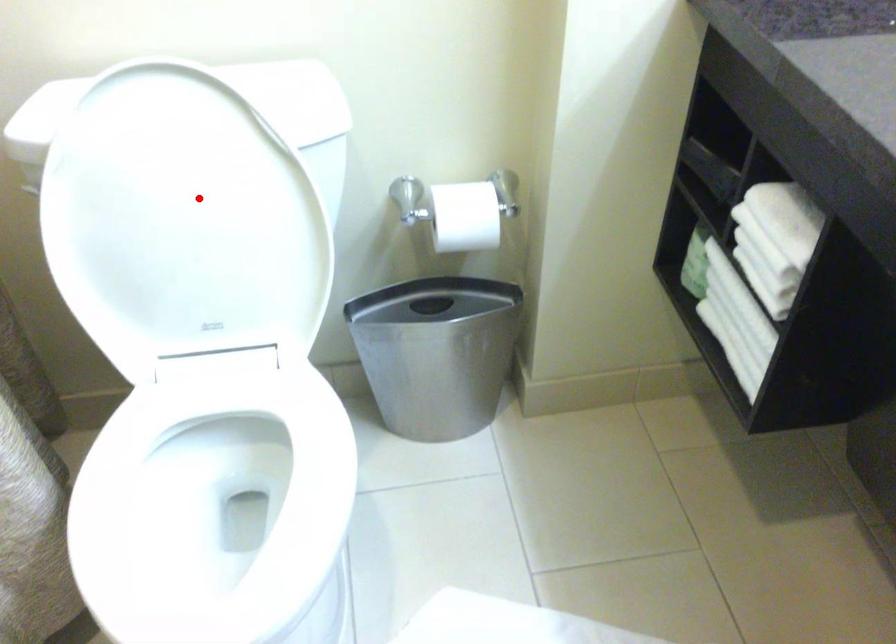
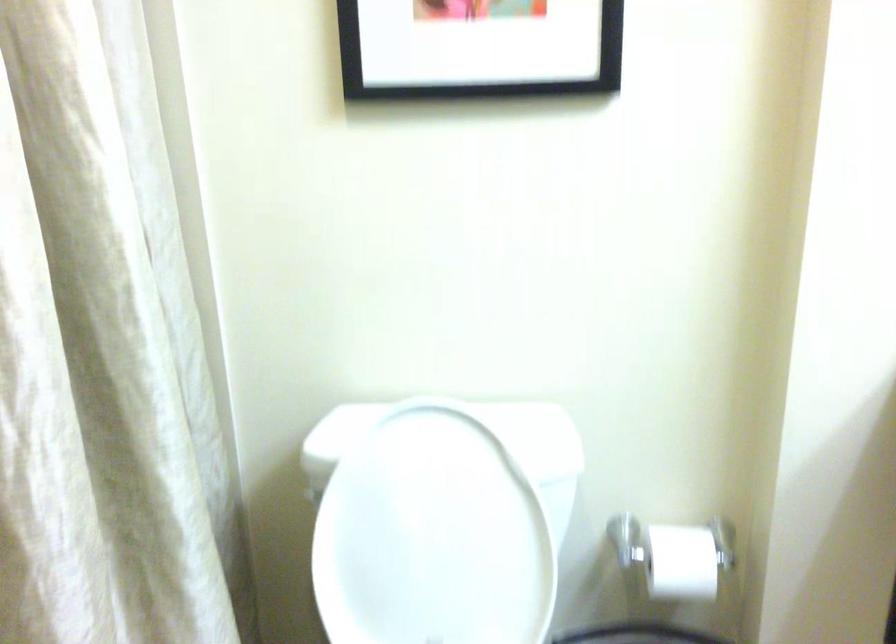
Locate, in the second image, the point that corresponds to the highlighted location in the first image.

(440, 520)